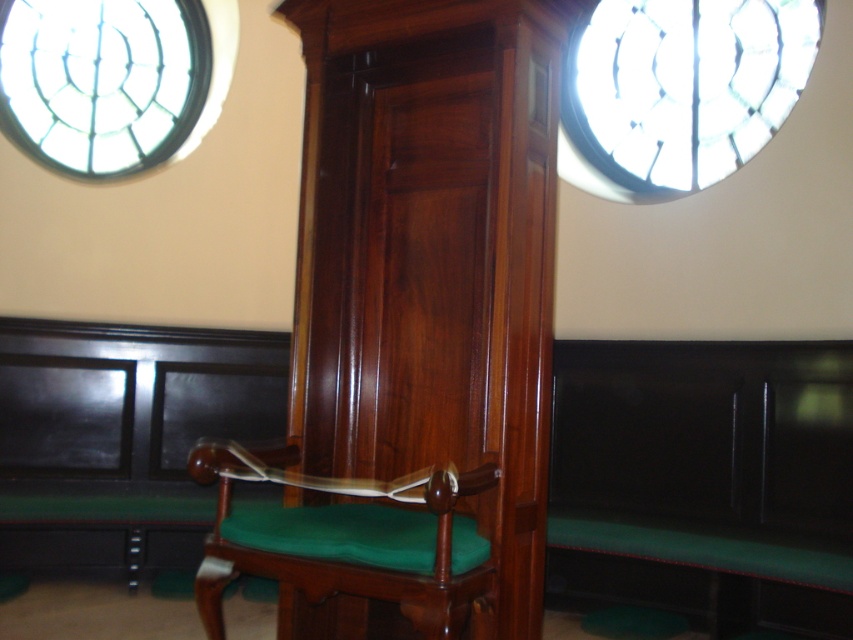
The width and height of the screenshot is (853, 640). In order to click on green fabric bench at center in this screenshot , I will do `click(704, 481)`.

You are a GUI agent. You are given a task and a screenshot of the screen. Output one action in this format:
    pyautogui.click(x=<x>, y=<y>)
    Task: Click on the green fabric bench at center
    This screenshot has height=640, width=853.
    Given the screenshot: What is the action you would take?
    pyautogui.click(x=704, y=481)

Describe the element at coordinates (120, 438) in the screenshot. I see `green fabric bench at lower left` at that location.

Can you confirm if green fabric bench at lower left is shorter than green velvet cushion at center?

In fact, green fabric bench at lower left may be taller than green velvet cushion at center.

Describe the element at coordinates (120, 438) in the screenshot. This screenshot has width=853, height=640. I see `green fabric bench at lower left` at that location.

You are a GUI agent. You are given a task and a screenshot of the screen. Output one action in this format:
    pyautogui.click(x=<x>, y=<y>)
    Task: Click on the green fabric bench at lower left
    This screenshot has height=640, width=853.
    Given the screenshot: What is the action you would take?
    pyautogui.click(x=120, y=438)

Is green fabric bench at center taller than green fabric bench at lower left?

In fact, green fabric bench at center may be shorter than green fabric bench at lower left.

Between green fabric bench at center and green fabric bench at lower left, which one appears on the right side from the viewer's perspective?

green fabric bench at center

Which is in front, point (646, 508) or point (152, 346)?

Point (646, 508) is in front.

The image size is (853, 640). I want to click on green fabric bench at center, so click(x=704, y=481).